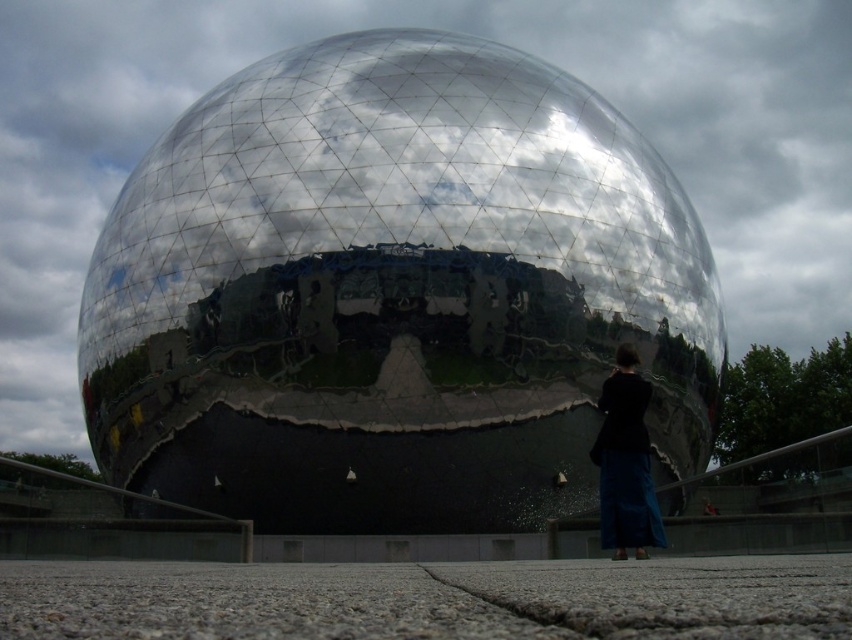
Is metallic sphere at center to the right of dark blue fabric at lower right from the viewer's perspective?

No, metallic sphere at center is not to the right of dark blue fabric at lower right.

Is metallic sphere at center taller than dark blue fabric at lower right?

Indeed, metallic sphere at center has a greater height compared to dark blue fabric at lower right.

Between point (511, 202) and point (628, 541), which one is positioned in front?

Point (628, 541)

Locate an element on the screen. The width and height of the screenshot is (852, 640). metallic sphere at center is located at coordinates (393, 292).